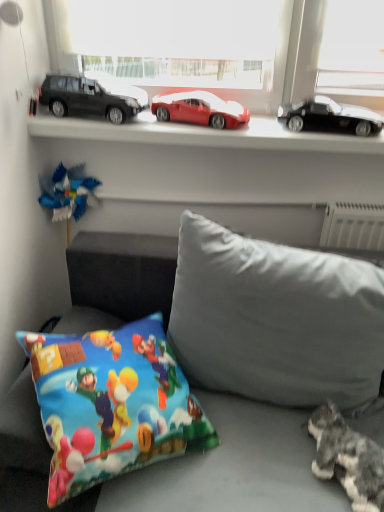
Question: Considering the relative sizes of matte black car at left, the third car in the right-to-left sequence, and gray fabric pillow at center, marked as the second pillow in a left-to-right arrangement, in the image provided, is matte black car at left, the third car in the right-to-left sequence, taller than gray fabric pillow at center, marked as the second pillow in a left-to-right arrangement,?

Choices:
 (A) yes
 (B) no

Answer: (B)

Question: Considering the relative sizes of matte black car at left, which ranks as the first car in left-to-right order, and gray fabric pillow at center, arranged as the 1th pillow when viewed from the right, in the image provided, is matte black car at left, which ranks as the first car in left-to-right order, thinner than gray fabric pillow at center, arranged as the 1th pillow when viewed from the right,?

Choices:
 (A) no
 (B) yes

Answer: (B)

Question: Is matte black car at left, which ranks as the first car in left-to-right order, to the left of gray fabric pillow at center, arranged as the 1th pillow when viewed from the right, from the viewer's perspective?

Choices:
 (A) no
 (B) yes

Answer: (B)

Question: Can you confirm if matte black car at left, the third car in the right-to-left sequence, is wider than gray fabric pillow at center, arranged as the 1th pillow when viewed from the right?

Choices:
 (A) no
 (B) yes

Answer: (A)

Question: Is matte black car at left, the third car in the right-to-left sequence, oriented away from gray fabric pillow at center, arranged as the 1th pillow when viewed from the right?

Choices:
 (A) no
 (B) yes

Answer: (A)

Question: Visually, is matte black car at left, the third car in the right-to-left sequence, positioned to the left or to the right of gray fabric pillow at center, arranged as the 1th pillow when viewed from the right?

Choices:
 (A) right
 (B) left

Answer: (B)

Question: Choose the correct answer: Is matte black car at left, which ranks as the first car in left-to-right order, inside gray fabric pillow at center, arranged as the 1th pillow when viewed from the right, or outside it?

Choices:
 (A) inside
 (B) outside

Answer: (B)

Question: From their relative heights in the image, would you say matte black car at left, which ranks as the first car in left-to-right order, is taller or shorter than gray fabric pillow at center, arranged as the 1th pillow when viewed from the right?

Choices:
 (A) short
 (B) tall

Answer: (A)

Question: Based on their sizes in the image, would you say matte black car at left, which ranks as the first car in left-to-right order, is bigger or smaller than gray fabric pillow at center, arranged as the 1th pillow when viewed from the right?

Choices:
 (A) small
 (B) big

Answer: (A)

Question: Considering the positions of point (205, 311) and point (150, 328), is point (205, 311) closer or farther from the camera than point (150, 328)?

Choices:
 (A) closer
 (B) farther

Answer: (A)

Question: Considering their positions, is gray fabric pillow at center, arranged as the 1th pillow when viewed from the right, located in front of or behind printed fabric pillow at lower left, which is the second pillow in right-to-left order?

Choices:
 (A) behind
 (B) front

Answer: (A)

Question: In terms of height, does gray fabric pillow at center, arranged as the 1th pillow when viewed from the right, look taller or shorter compared to printed fabric pillow at lower left, which is the second pillow in right-to-left order?

Choices:
 (A) tall
 (B) short

Answer: (A)

Question: From the image's perspective, is gray fabric pillow at center, arranged as the 1th pillow when viewed from the right, positioned above or below printed fabric pillow at lower left, which appears as the 1th pillow when viewed from the left?

Choices:
 (A) above
 (B) below

Answer: (A)

Question: Which is correct: soft gray fabric couch at lower center is inside matte black car at left, the third car in the right-to-left sequence, or outside of it?

Choices:
 (A) inside
 (B) outside

Answer: (B)

Question: Does point 150,270 appear closer or farther from the camera than point 110,87?

Choices:
 (A) farther
 (B) closer

Answer: (B)